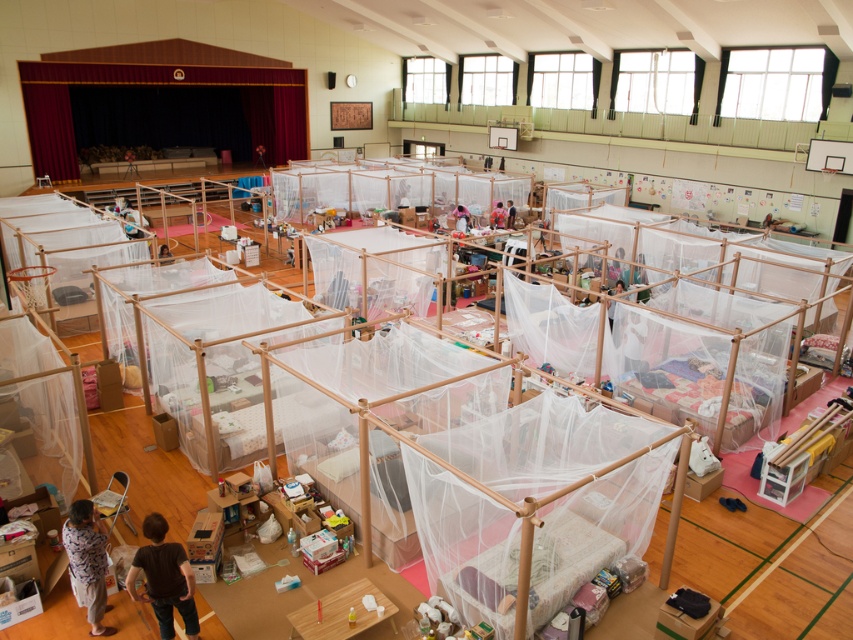
Question: Is white mesh canopy bed at center behind brown fabric child at lower left?

Choices:
 (A) no
 (B) yes

Answer: (B)

Question: Can you confirm if brown fabric child at lower left is positioned below light blue fabric shirt at lower left?

Choices:
 (A) yes
 (B) no

Answer: (A)

Question: Which point is closer to the camera taking this photo?

Choices:
 (A) (165, 624)
 (B) (440, 200)
 (C) (96, 627)

Answer: (A)

Question: Is white mesh canopy bed at center to the left of light blue fabric shirt at lower left from the viewer's perspective?

Choices:
 (A) yes
 (B) no

Answer: (B)

Question: Estimate the real-world distances between objects in this image. Which object is farther from the brown fabric child at lower left?

Choices:
 (A) white mesh canopy bed at center
 (B) light blue fabric shirt at lower left

Answer: (A)

Question: Which object is farther from the camera taking this photo?

Choices:
 (A) light blue fabric shirt at lower left
 (B) brown fabric child at lower left

Answer: (A)